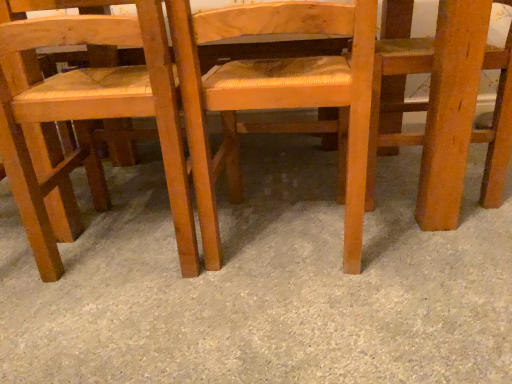
Question: Is gray carpet at center positioned beyond the bounds of wooden chair at center, which ranks as the 2th chair in left-to-right order?

Choices:
 (A) no
 (B) yes

Answer: (B)

Question: Is wooden chair at center, which ranks as the 2th chair in left-to-right order, a part of gray carpet at center?

Choices:
 (A) yes
 (B) no

Answer: (B)

Question: Is gray carpet at center in contact with wooden chair at center, the 2th chair viewed from the right?

Choices:
 (A) yes
 (B) no

Answer: (B)

Question: Is gray carpet at center further to camera compared to wooden chair at center, the 2th chair viewed from the right?

Choices:
 (A) no
 (B) yes

Answer: (A)

Question: Can you confirm if gray carpet at center is shorter than wooden chair at center, which ranks as the 2th chair in left-to-right order?

Choices:
 (A) yes
 (B) no

Answer: (A)

Question: Can you confirm if gray carpet at center is thinner than wooden chair at center, the 2th chair viewed from the right?

Choices:
 (A) no
 (B) yes

Answer: (A)

Question: Are wooden woven seat at left, which ranks as the first chair in left-to-right order, and wooden chair at center, the 2th chair viewed from the right, making contact?

Choices:
 (A) yes
 (B) no

Answer: (B)

Question: Does wooden woven seat at left, the 3th chair in the right-to-left sequence, have a larger size compared to wooden chair at center, which ranks as the 2th chair in left-to-right order?

Choices:
 (A) no
 (B) yes

Answer: (B)

Question: Is wooden woven seat at left, the 3th chair in the right-to-left sequence, outside wooden chair at center, which ranks as the 2th chair in left-to-right order?

Choices:
 (A) no
 (B) yes

Answer: (B)

Question: Does wooden woven seat at left, which ranks as the first chair in left-to-right order, appear on the left side of wooden chair at center, the 2th chair viewed from the right?

Choices:
 (A) yes
 (B) no

Answer: (A)

Question: Is wooden woven seat at left, which ranks as the first chair in left-to-right order, closer to the viewer compared to wooden chair at center, which ranks as the 2th chair in left-to-right order?

Choices:
 (A) no
 (B) yes

Answer: (A)

Question: Is the position of wooden woven seat at left, which ranks as the first chair in left-to-right order, more distant than that of wooden chair at center, which ranks as the 2th chair in left-to-right order?

Choices:
 (A) yes
 (B) no

Answer: (A)

Question: Is gray carpet at center positioned in front of wooden woven seat at left, which ranks as the first chair in left-to-right order?

Choices:
 (A) no
 (B) yes

Answer: (B)